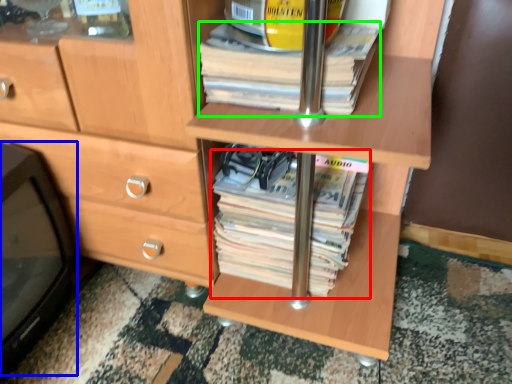
Question: Which object is the farthest from paperback book (highlighted by a red box)? Choose among these: desktop (highlighted by a blue box) or paperback book (highlighted by a green box).

Choices:
 (A) desktop
 (B) paperback book

Answer: (A)